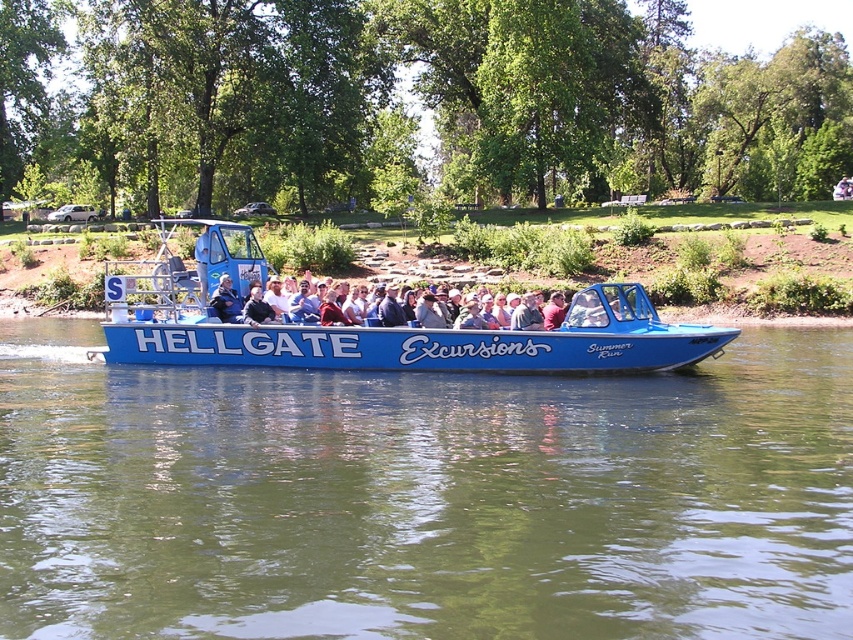
Can you confirm if blue plastic boat at center is bigger than matte black jacket at center?

Yes.

Who is positioned more to the left, blue plastic boat at center or matte black jacket at center?

blue plastic boat at center is more to the left.

Is point (625, 310) positioned behind point (532, 308)?

No, (625, 310) is closer to viewer.

The width and height of the screenshot is (853, 640). I want to click on blue plastic boat at center, so click(379, 328).

From the picture: Can you confirm if green smooth water at center is wider than blue plastic boat at center?

In fact, green smooth water at center might be narrower than blue plastic boat at center.

Describe the element at coordinates (424, 497) in the screenshot. The height and width of the screenshot is (640, 853). I see `green smooth water at center` at that location.

The image size is (853, 640). I want to click on green smooth water at center, so click(x=424, y=497).

Can you confirm if green smooth water at center is smaller than matte black jacket at center?

No, green smooth water at center is not smaller than matte black jacket at center.

Is point (593, 506) positioned before point (264, 300)?

That is True.

Is point (705, 554) more distant than point (480, 326)?

No, (705, 554) is closer to viewer.

The image size is (853, 640). Find the location of `green smooth water at center`. green smooth water at center is located at coordinates (424, 497).